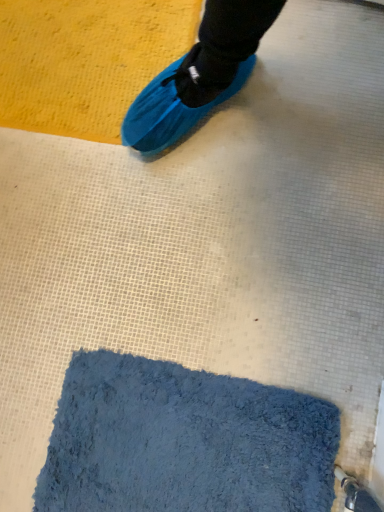
Locate an element on the screen. blue fuzzy bath mat at lower center is located at coordinates (184, 441).

What do you see at coordinates (184, 441) in the screenshot?
I see `blue fuzzy bath mat at lower center` at bounding box center [184, 441].

What are the coordinates of `blue fuzzy bath mat at lower center` in the screenshot? It's located at [184, 441].